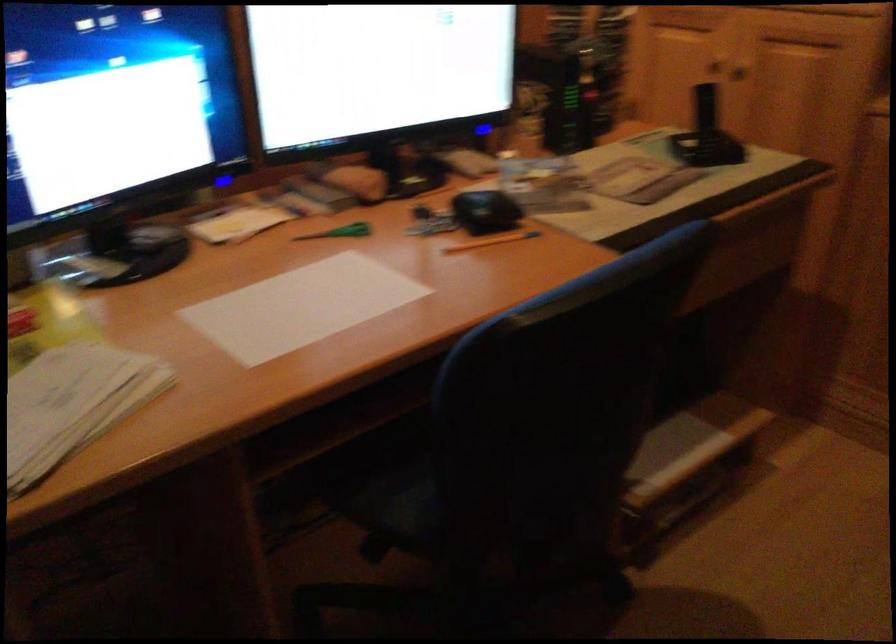
What do you see at coordinates (705, 135) in the screenshot? This screenshot has height=644, width=896. I see `a black telephone handset` at bounding box center [705, 135].